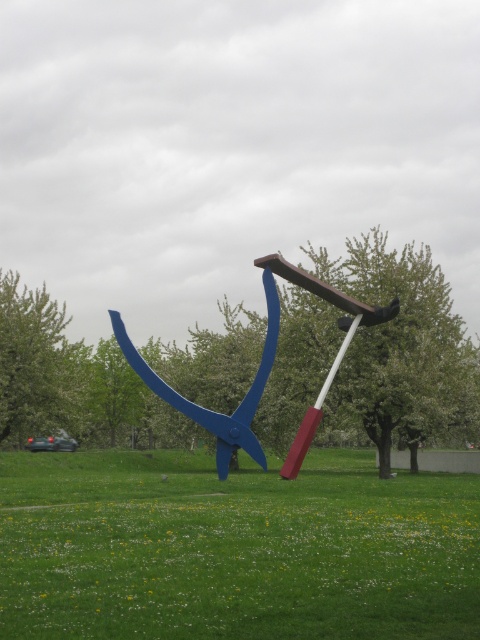
Is point (137, 524) positioned behind point (184, 406)?

No, (137, 524) is closer to viewer.

At what (x,y) coordinates should I click in order to perform the action: click on green grass at center. Please return your answer as a coordinate pair (x, y). Looking at the image, I should click on (233, 548).